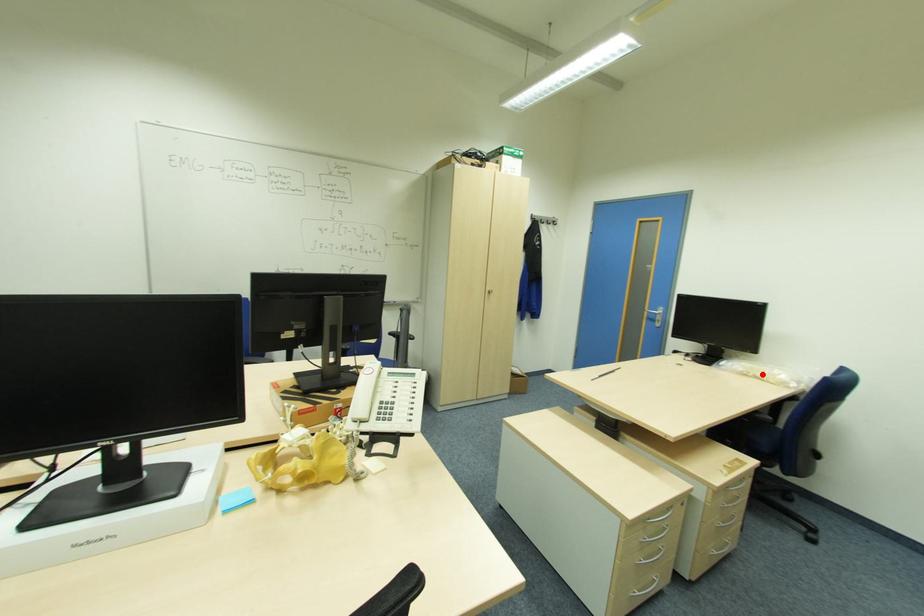
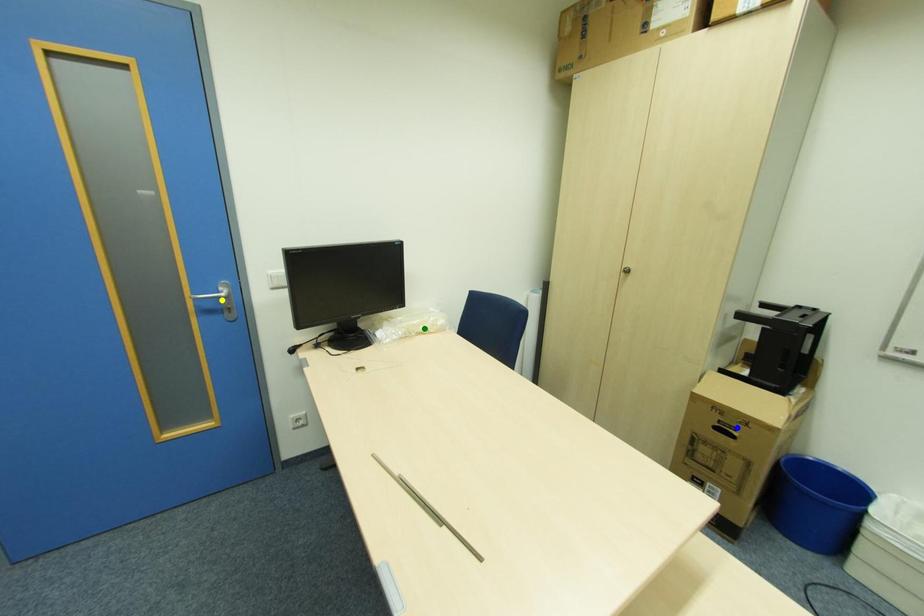
Question: I am providing you with two images of the same scene from different viewpoints. A red point is marked on the first image. You are given multiple points on the second image. Can you choose the point in image 2 that corresponds to the point in image 1?

Choices:
 (A) blue point
 (B) green point
 (C) yellow point

Answer: (B)